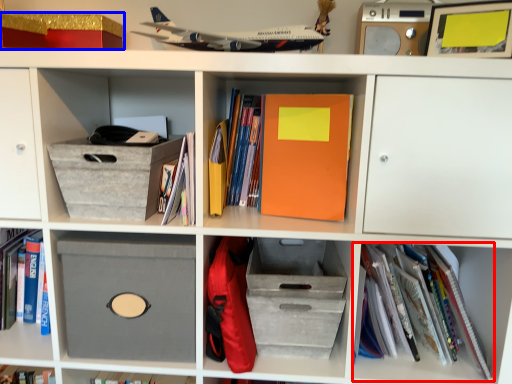
Question: Which object is closer to the camera taking this photo, book (highlighted by a red box) or storage box (highlighted by a blue box)?

Choices:
 (A) book
 (B) storage box

Answer: (A)